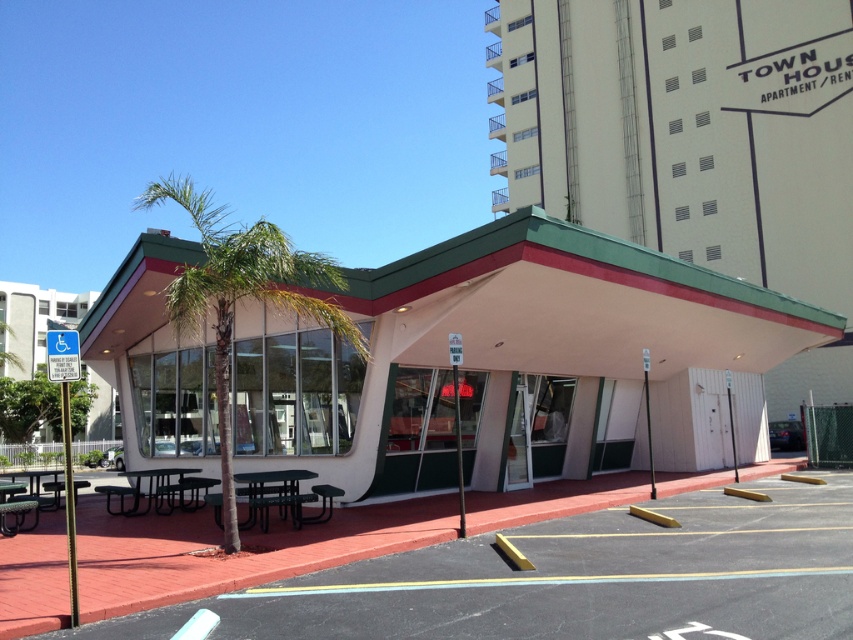
Is white plastic sign at left positioned in front of green plastic picnic table at center?

That is False.

Can you confirm if white plastic sign at left is positioned above green plastic picnic table at center?

Indeed, white plastic sign at left is positioned over green plastic picnic table at center.

Does point (106, 396) come behind point (143, 474)?

That is True.

Where is `white plastic sign at left`? white plastic sign at left is located at coordinates (35, 323).

Between point (99, 378) and point (245, 525), which one is positioned in front?

Point (245, 525) is in front.

Who is higher up, white plastic sign at left or black metal picnic table at center?

Positioned higher is white plastic sign at left.

Is point (48, 316) in front of point (260, 504)?

No.

Find the location of a particular element. This screenshot has height=640, width=853. white plastic sign at left is located at coordinates (35, 323).

Between point (805, 65) and point (283, 480), which one is positioned behind?

The point (805, 65) is behind.

Looking at this image, who is positioned more to the left, beige/white textured hotel at center or black metal picnic table at center?

black metal picnic table at center

Does point (650, 234) come farther from viewer compared to point (245, 524)?

Yes, it is.

You are a GUI agent. You are given a task and a screenshot of the screen. Output one action in this format:
    pyautogui.click(x=<x>, y=<y>)
    Task: Click on the beige/white textured hotel at center
    The width and height of the screenshot is (853, 640).
    Given the screenshot: What is the action you would take?
    pyautogui.click(x=692, y=141)